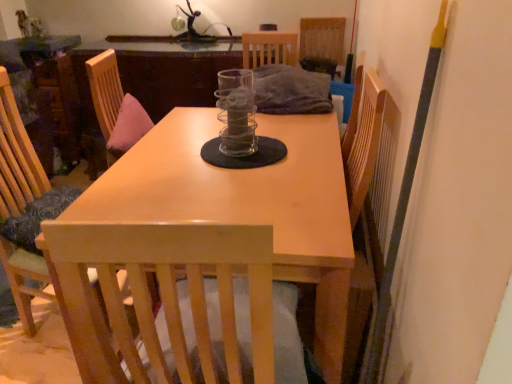
Find the location of a particular element. The image size is (512, 384). free space above light wood table at center (from a real-world perspective) is located at coordinates (218, 162).